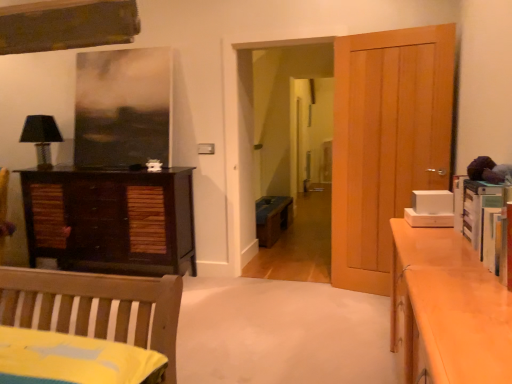
This screenshot has height=384, width=512. What do you see at coordinates (272, 218) in the screenshot?
I see `wooden bench at center` at bounding box center [272, 218].

At what (x,y) coordinates should I click in order to perform the action: click on wooden bench at center. Please return your answer as a coordinate pair (x, y). Looking at the image, I should click on (272, 218).

From the image's perspective, is light brown wooden door at right beneath black fabric lampshade at left?

Indeed, from the image's perspective, light brown wooden door at right is shown beneath black fabric lampshade at left.

Considering the sizes of objects light brown wooden door at right and black fabric lampshade at left in the image provided, who is taller, light brown wooden door at right or black fabric lampshade at left?

light brown wooden door at right.

Considering the sizes of objects light brown wooden door at right and black fabric lampshade at left in the image provided, who is wider, light brown wooden door at right or black fabric lampshade at left?

black fabric lampshade at left.

Would you say light brown wooden door at right is outside black fabric lampshade at left?

Yes, light brown wooden door at right is outside of black fabric lampshade at left.

Would you say wooden bench at center contains black fabric lampshade at left?

No, wooden bench at center does not contain black fabric lampshade at left.

Which of these two, wooden bench at center or black fabric lampshade at left, is bigger?

With larger size is wooden bench at center.

Is point (286, 225) less distant than point (47, 152)?

No, (286, 225) is behind (47, 152).

Are wooden bench at center and black fabric lampshade at left far apart?

wooden bench at center is far away from black fabric lampshade at left.

You are a GUI agent. You are given a task and a screenshot of the screen. Output one action in this format:
    pyautogui.click(x=<x>, y=<y>)
    Task: Click on the chest of drawers that is under the light brown wooden door at right (from a real-world perspective)
    
    Given the screenshot: What is the action you would take?
    pyautogui.click(x=110, y=219)

From a real-world perspective, which object stands above the other?

light brown wooden door at right is physically above.

Is light brown wooden door at right placed right next to dark wood cabinet at left?

No, light brown wooden door at right is not next to dark wood cabinet at left.

From the picture: Is light brown wooden door at right closer to camera compared to dark wood cabinet at left?

Yes.

From a real-world perspective, is dark wood cabinet at left above or below wooden bench at center?

dark wood cabinet at left is above wooden bench at center.

Where is `cabinetry located on the right of dark wood cabinet at left`? This screenshot has height=384, width=512. cabinetry located on the right of dark wood cabinet at left is located at coordinates tap(272, 218).

Is dark wood cabinet at left oriented towards wooden bench at center?

No, dark wood cabinet at left does not turn towards wooden bench at center.

Is dark wood cabinet at left in front of or behind wooden bench at center in the image?

Visually, dark wood cabinet at left is located in front of wooden bench at center.

Considering the relative sizes of wooden bench at center and dark wood cabinet at left in the image provided, is wooden bench at center shorter than dark wood cabinet at left?

Indeed, wooden bench at center has a lesser height compared to dark wood cabinet at left.

Based on the photo, who is smaller, wooden bench at center or dark wood cabinet at left?

wooden bench at center is smaller.

Is wooden bench at center directly adjacent to dark wood cabinet at left?

No.

Could you tell me if wooden bench at center is turned towards dark wood cabinet at left?

No, wooden bench at center does not turn towards dark wood cabinet at left.

Between black fabric lampshade at left and dark wood cabinet at left, which one has less height?

Standing shorter between the two is black fabric lampshade at left.

Based on the photo, how many degrees apart are the facing directions of black fabric lampshade at left and dark wood cabinet at left?

They differ by 0.437 degrees in their facing directions.

Based on the photo, is black fabric lampshade at left bigger than dark wood cabinet at left?

No, black fabric lampshade at left is not bigger than dark wood cabinet at left.

In terms of width, does dark wood cabinet at left look wider or thinner when compared to light brown wooden door at right?

Considering their sizes, dark wood cabinet at left looks broader than light brown wooden door at right.

Can light brown wooden door at right be found inside dark wood cabinet at left?

No, light brown wooden door at right is not surrounded by dark wood cabinet at left.

The image size is (512, 384). I want to click on lamp that appears above the light brown wooden door at right (from the image's perspective), so click(x=41, y=137).

The image size is (512, 384). Find the location of `lamp in front of the wooden bench at center`. lamp in front of the wooden bench at center is located at coordinates pos(41,137).

Based on their spatial positions, is wooden bench at center or dark wood cabinet at left closer to black fabric lampshade at left?

dark wood cabinet at left.

Estimate the real-world distances between objects in this image. Which object is further from light brown wooden door at right, dark wood cabinet at left or black fabric lampshade at left?

black fabric lampshade at left is positioned further to the anchor light brown wooden door at right.

Which object lies nearer to the anchor point wooden bench at center, dark wood cabinet at left or light brown wooden door at right?

Based on the image, dark wood cabinet at left appears to be nearer to wooden bench at center.

Which object lies nearer to the anchor point wooden bench at center, black fabric lampshade at left or dark wood cabinet at left?

dark wood cabinet at left lies closer to wooden bench at center than the other object.

Looking at this image, looking at the image, which one is located further to light brown wooden door at right, dark wood cabinet at left or wooden bench at center?

The object further to light brown wooden door at right is dark wood cabinet at left.

From the image, which object appears to be farther from wooden bench at center, black fabric lampshade at left or light brown wooden door at right?

black fabric lampshade at left lies further to wooden bench at center than the other object.

Considering their positions, is black fabric lampshade at left positioned closer to light brown wooden door at right than wooden bench at center?

wooden bench at center is closer to light brown wooden door at right.

Looking at the image, which one is located closer to black fabric lampshade at left, dark wood cabinet at left or light brown wooden door at right?

Among the two, dark wood cabinet at left is located nearer to black fabric lampshade at left.

I want to click on the chest of drawers situated between black fabric lampshade at left and light brown wooden door at right from left to right, so click(110, 219).

You are a GUI agent. You are given a task and a screenshot of the screen. Output one action in this format:
    pyautogui.click(x=<x>, y=<y>)
    Task: Click on the cabinetry between black fabric lampshade at left and light brown wooden door at right in the horizontal direction
    The width and height of the screenshot is (512, 384).
    Given the screenshot: What is the action you would take?
    pyautogui.click(x=272, y=218)

I want to click on chest of drawers between black fabric lampshade at left and wooden bench at center from left to right, so click(110, 219).

The height and width of the screenshot is (384, 512). I want to click on cabinetry between dark wood cabinet at left and light brown wooden door at right from left to right, so click(x=272, y=218).